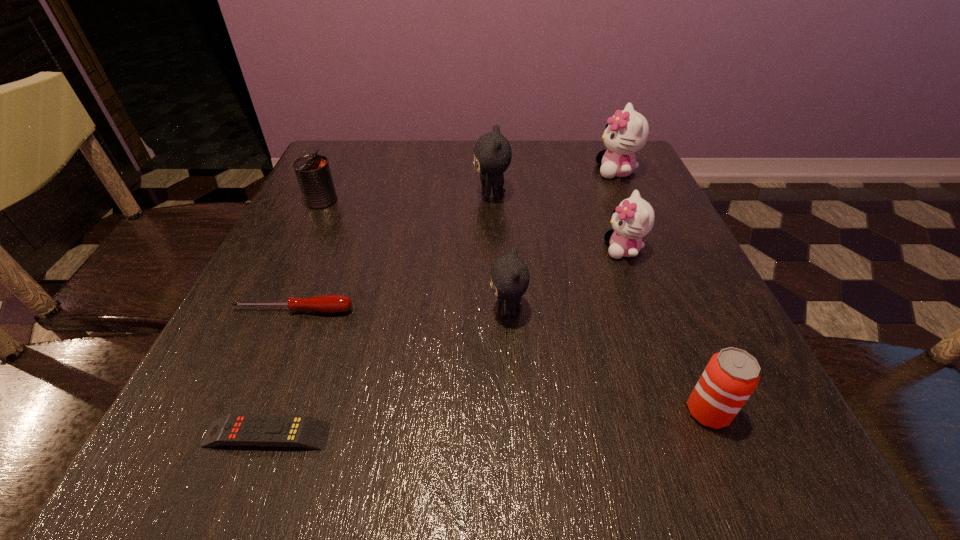
I want to click on vacant area that lies between the nearest kitten and the yellow remote control, so click(x=387, y=373).

Image resolution: width=960 pixels, height=540 pixels. Find the location of `vacant area between the nearer gray kitten and the screwdriver`. vacant area between the nearer gray kitten and the screwdriver is located at coordinates (400, 310).

The image size is (960, 540). I want to click on the sixth closest object to the fifth nearest object, so click(302, 431).

At what (x,y) coordinates should I click in order to perform the action: click on object that ranks as the seventh closest to the second shortest object. Please return your answer as a coordinate pair (x, y). The height and width of the screenshot is (540, 960). Looking at the image, I should click on (626, 132).

Where is `kitten that is the nearest to the beer can`? kitten that is the nearest to the beer can is located at coordinates (510, 277).

Identify which kitten is located as the nearest to the nearest kitten. Please provide its 2D coordinates. Your answer should be formatted as a tuple, i.e. [(x, y)], where the tuple contains the x and y coordinates of a point satisfying the conditions above.

[(633, 219)]

Image resolution: width=960 pixels, height=540 pixels. I want to click on vacant region that satisfies the following two spatial constraints: 1. on the front-facing side of the bigger white kitten; 2. on the front side of the red screwdriver, so click(x=679, y=310).

Where is `vacant space that satisfies the following two spatial constraints: 1. on the front-facing side of the farther gray kitten; 2. on the back side of the beer can`? vacant space that satisfies the following two spatial constraints: 1. on the front-facing side of the farther gray kitten; 2. on the back side of the beer can is located at coordinates (499, 411).

Locate an element on the screen. free location that satisfies the following two spatial constraints: 1. on the front side of the orange beer can; 2. on the right side of the can is located at coordinates (221, 411).

Locate an element on the screen. This screenshot has height=540, width=960. vacant space that satisfies the following two spatial constraints: 1. on the front-facing side of the bigger white kitten; 2. on the front side of the screwdriver is located at coordinates (679, 310).